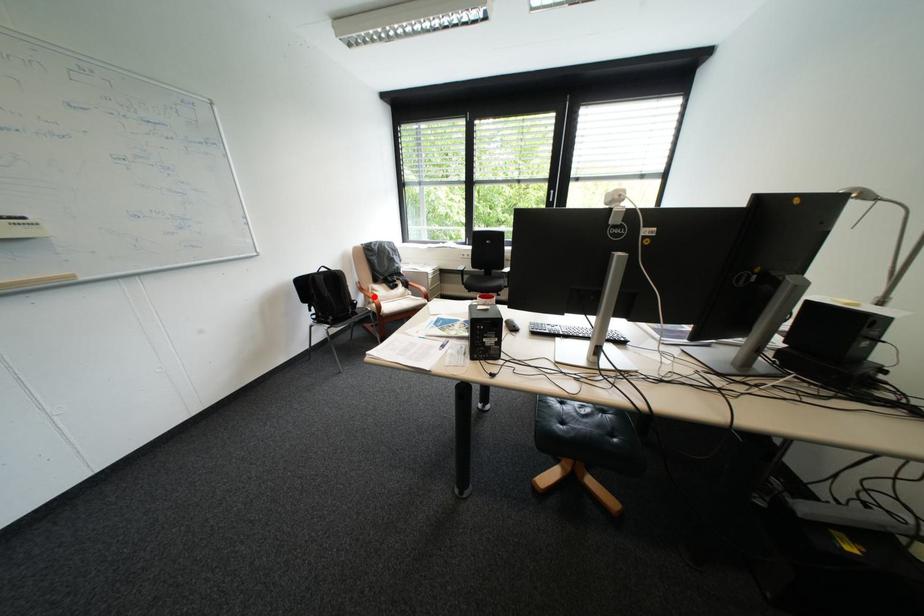
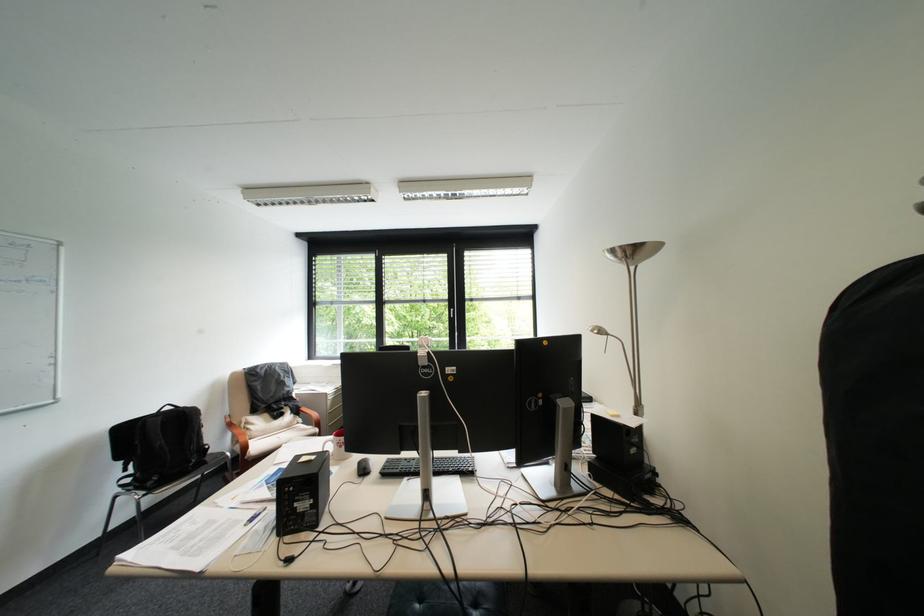
Where in the second image is the point corresponding to the highlighted location from the first image?

(241, 434)